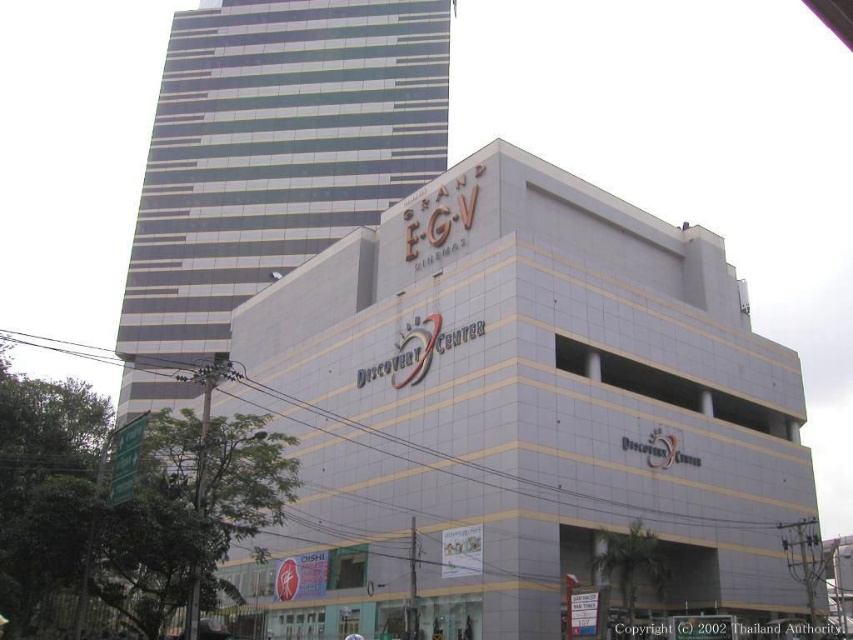
Question: Is white smooth building at center below metallic glass building at upper left?

Choices:
 (A) yes
 (B) no

Answer: (A)

Question: Is white smooth building at center above metallic glass building at upper left?

Choices:
 (A) no
 (B) yes

Answer: (A)

Question: Is white smooth building at center smaller than metallic glass building at upper left?

Choices:
 (A) yes
 (B) no

Answer: (A)

Question: Among these objects, which one is farthest from the camera?

Choices:
 (A) white smooth building at center
 (B) metallic glass building at upper left

Answer: (B)

Question: Which point is farther to the camera?

Choices:
 (A) (633, 460)
 (B) (229, 131)

Answer: (B)